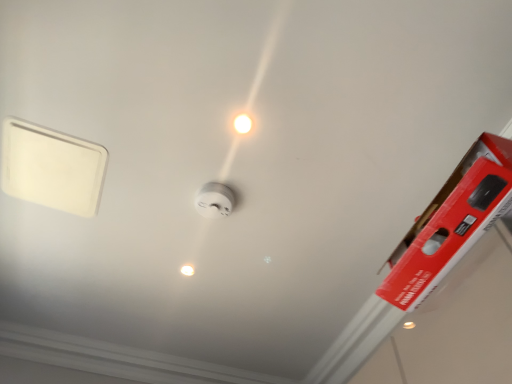
Question: From the image's perspective, is white glossy light bulb at center, which is the second light bulb from right to left, located above or below white glossy light bulb at center, placed as the 2th light bulb when sorted from left to right?

Choices:
 (A) above
 (B) below

Answer: (B)

Question: Based on their positions, is white glossy light bulb at center, which is the second light bulb from right to left, located to the left or right of white glossy light bulb at center, the second light bulb viewed from the back?

Choices:
 (A) right
 (B) left

Answer: (B)

Question: Which object is the closest to the white plastic smoke detector at center?

Choices:
 (A) white glossy light bulb at center, which is the second light bulb from right to left
 (B) white glossy light bulb at center, the second light bulb viewed from the back

Answer: (B)

Question: Estimate the real-world distances between objects in this image. Which object is closer to the white glossy light bulb at center, placed as the 2th light bulb when sorted from left to right?

Choices:
 (A) white glossy light bulb at center, which is the second light bulb from right to left
 (B) white plastic smoke detector at center

Answer: (B)